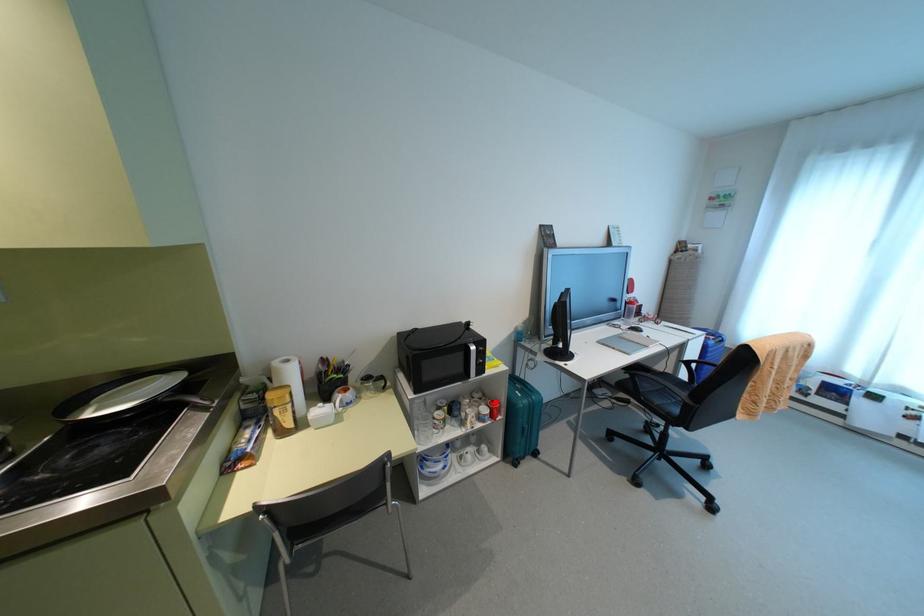
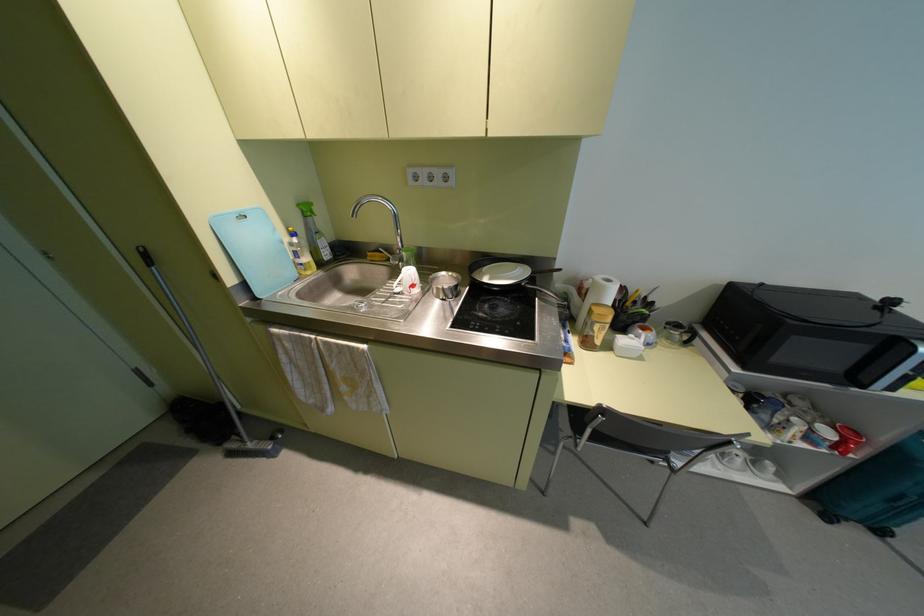
Question: I am providing you with two images of the same scene from different viewpoints. Image1 has a red point marked. In image2, the corresponding 3D location appears at what relative position? Reply with the corresponding letter.

Choices:
 (A) Closer
 (B) Farther

Answer: (A)